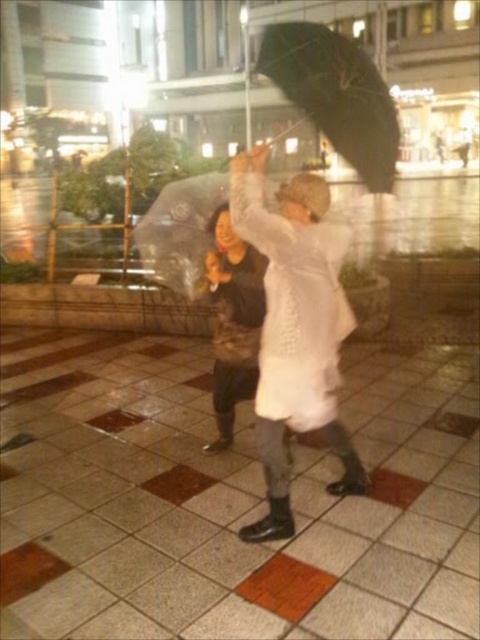
Question: Which object appears closest to the camera in this image?

Choices:
 (A) white matte coat at center
 (B) white matte coat at upper center

Answer: (A)

Question: Is white matte coat at center wider than white matte coat at upper center?

Choices:
 (A) no
 (B) yes

Answer: (B)

Question: Which object is the closest to the white matte coat at center?

Choices:
 (A) black matte umbrella at upper center
 (B) white matte coat at upper center

Answer: (B)

Question: Which object is positioned closest to the white matte coat at center?

Choices:
 (A) white matte coat at upper center
 (B) black matte umbrella at upper center

Answer: (A)

Question: Is white matte coat at center in front of white matte coat at upper center?

Choices:
 (A) yes
 (B) no

Answer: (A)

Question: Can you confirm if black matte umbrella at upper center is bigger than white matte coat at upper center?

Choices:
 (A) yes
 (B) no

Answer: (A)